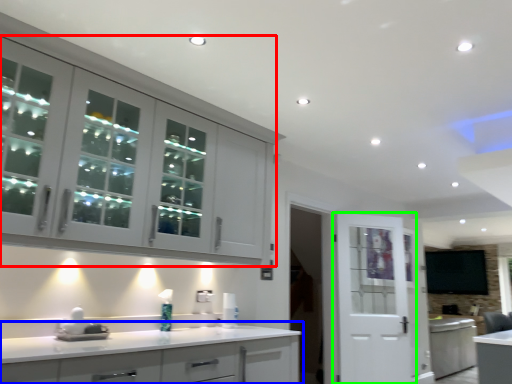
Question: Which object is the farthest from cabinetry (highlighted by a red box)? Choose among these: cabinetry (highlighted by a blue box) or door (highlighted by a green box).

Choices:
 (A) cabinetry
 (B) door

Answer: (B)